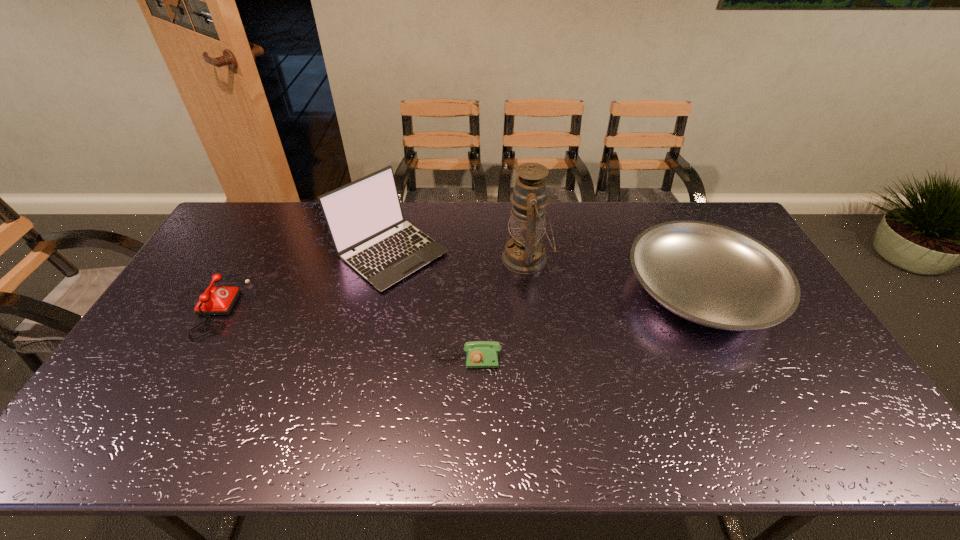
The image size is (960, 540). I want to click on vacant space located 0.100m at the front screen of the laptop_computer, so click(x=376, y=320).

Where is `vacant space situated 0.190m on the left of the bedpan`? Image resolution: width=960 pixels, height=540 pixels. vacant space situated 0.190m on the left of the bedpan is located at coordinates (564, 290).

Where is `vacant area located 0.280m on the dial of the left telephone`? The width and height of the screenshot is (960, 540). vacant area located 0.280m on the dial of the left telephone is located at coordinates (333, 304).

Where is `vacant space situated on the dial of the shortest object`? The width and height of the screenshot is (960, 540). vacant space situated on the dial of the shortest object is located at coordinates (464, 427).

What are the coordinates of `oil lamp situated at the far edge` in the screenshot? It's located at (525, 253).

This screenshot has height=540, width=960. I want to click on laptop_computer situated at the far edge, so click(362, 215).

Where is `object that is at the left edge`? This screenshot has height=540, width=960. object that is at the left edge is located at coordinates (215, 300).

Where is `object that is positioned at the right edge`? Image resolution: width=960 pixels, height=540 pixels. object that is positioned at the right edge is located at coordinates (712, 275).

In the image, there is a desktop. At what (x,y) coordinates should I click in order to perform the action: click on vacant region at the far edge. Please return your answer as a coordinate pair (x, y). Looking at the image, I should click on [482, 206].

Locate an element on the screen. This screenshot has height=540, width=960. vacant space at the near edge of the desktop is located at coordinates (730, 437).